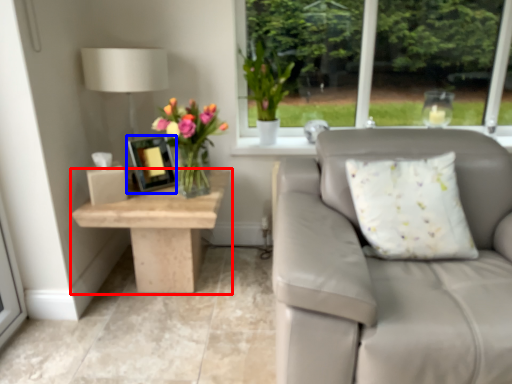
Question: Which object appears closest to the camera in this image, table (highlighted by a red box) or picture frame (highlighted by a blue box)?

Choices:
 (A) table
 (B) picture frame

Answer: (A)